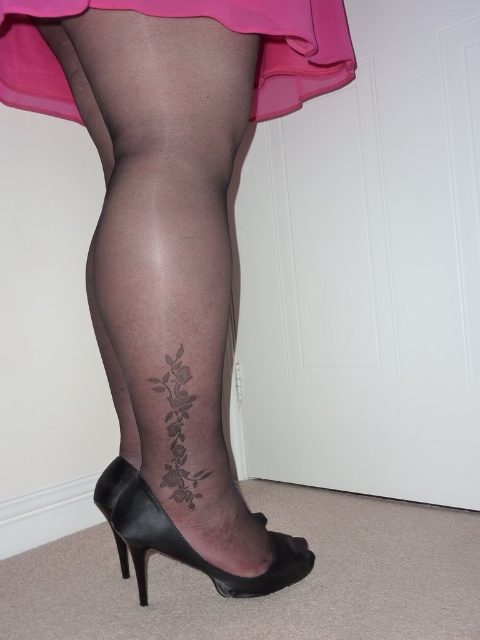
Question: Which point is closer to the camera taking this photo?

Choices:
 (A) (180, 496)
 (B) (110, 480)
 (C) (231, 579)
 (D) (284, 60)

Answer: (A)

Question: Is sheer black tights at center positioned behind black leather shoe at lower center?

Choices:
 (A) no
 (B) yes

Answer: (A)

Question: Estimate the real-world distances between objects in this image. Which object is closer to the sheer black tights at center?

Choices:
 (A) matte pink fabric at upper center
 (B) black leather shoe at lower center

Answer: (B)

Question: Can you confirm if black leather shoe at lower center is positioned to the right of black ink rose at lower left?

Choices:
 (A) yes
 (B) no

Answer: (B)

Question: Which object appears farthest from the camera in this image?

Choices:
 (A) sheer black tights at center
 (B) black ink rose at lower left
 (C) matte pink fabric at upper center
 (D) black leather shoe at lower center

Answer: (D)

Question: Is matte pink fabric at upper center below black ink rose at lower left?

Choices:
 (A) no
 (B) yes

Answer: (A)